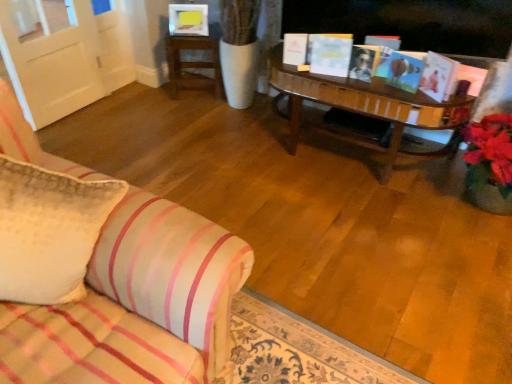
Question: In which direction should I rotate to look at white paper book at center, arranged as the second book when viewed from the right?

Choices:
 (A) left
 (B) right

Answer: (B)

Question: Are white paper book at center, arranged as the second book when viewed from the right, and white textured pillow at left far apart?

Choices:
 (A) no
 (B) yes

Answer: (B)

Question: Considering the relative sizes of white paper book at center, arranged as the second book when viewed from the right, and white textured pillow at left in the image provided, is white paper book at center, arranged as the second book when viewed from the right, bigger than white textured pillow at left?

Choices:
 (A) no
 (B) yes

Answer: (A)

Question: Considering the relative sizes of white paper book at center, arranged as the second book when viewed from the right, and white textured pillow at left in the image provided, is white paper book at center, arranged as the second book when viewed from the right, thinner than white textured pillow at left?

Choices:
 (A) yes
 (B) no

Answer: (A)

Question: Can you confirm if white paper book at center, arranged as the second book when viewed from the right, is wider than white textured pillow at left?

Choices:
 (A) no
 (B) yes

Answer: (A)

Question: From the image's perspective, would you say white paper book at center, arranged as the second book when viewed from the right, is shown under white textured pillow at left?

Choices:
 (A) no
 (B) yes

Answer: (A)

Question: Considering the relative sizes of white paper book at center, arranged as the second book when viewed from the right, and white textured pillow at left in the image provided, is white paper book at center, arranged as the second book when viewed from the right, shorter than white textured pillow at left?

Choices:
 (A) no
 (B) yes

Answer: (B)

Question: Considering the relative sizes of matte pink book at upper right, which ranks as the 3th book in left-to-right order, and white matte book at upper center, marked as the third book in a right-to-left arrangement, in the image provided, is matte pink book at upper right, which ranks as the 3th book in left-to-right order, smaller than white matte book at upper center, marked as the third book in a right-to-left arrangement,?

Choices:
 (A) yes
 (B) no

Answer: (B)

Question: Is matte pink book at upper right, which is the 1th book from right to left, not within white matte book at upper center, which is counted as the first book, starting from the left?

Choices:
 (A) no
 (B) yes

Answer: (B)

Question: From a real-world perspective, is matte pink book at upper right, which ranks as the 3th book in left-to-right order, on top of white matte book at upper center, which is counted as the first book, starting from the left?

Choices:
 (A) yes
 (B) no

Answer: (A)

Question: Does matte pink book at upper right, which is the 1th book from right to left, appear on the left side of white matte book at upper center, marked as the third book in a right-to-left arrangement?

Choices:
 (A) yes
 (B) no

Answer: (B)

Question: Is matte pink book at upper right, which ranks as the 3th book in left-to-right order, far away from white matte book at upper center, which is counted as the first book, starting from the left?

Choices:
 (A) no
 (B) yes

Answer: (A)

Question: Considering the relative sizes of matte pink book at upper right, which is the 1th book from right to left, and white matte book at upper center, marked as the third book in a right-to-left arrangement, in the image provided, is matte pink book at upper right, which is the 1th book from right to left, wider than white matte book at upper center, marked as the third book in a right-to-left arrangement,?

Choices:
 (A) yes
 (B) no

Answer: (B)

Question: Does wooden table at upper center have a larger size compared to matte pink book at upper right, which is the 1th book from right to left?

Choices:
 (A) yes
 (B) no

Answer: (A)